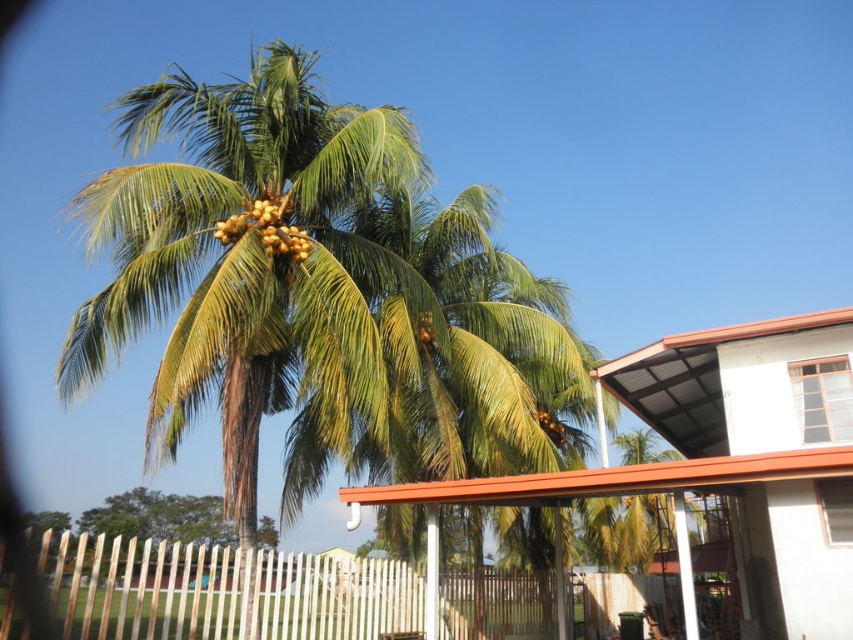
Question: Estimate the real-world distances between objects in this image. Which object is farther from the white wooden fence at lower left?

Choices:
 (A) green leafy palm at lower left
 (B) yellow matte coconuts at center
 (C) green leafy coconut tree at center

Answer: (B)

Question: Which point appears closest to the camera in this image?

Choices:
 (A) (416, 321)
 (B) (352, 497)
 (C) (140, 538)

Answer: (B)

Question: Which object is farther from the camera taking this photo?

Choices:
 (A) green leafy palm at lower left
 (B) green leafy coconut tree at center

Answer: (B)

Question: Observing the image, what is the correct spatial positioning of green leafy coconut tree at center in reference to yellow matte coconuts at upper center?

Choices:
 (A) below
 (B) above

Answer: (A)

Question: Does brown corrugated metal roof at upper center appear on the right side of white wooden fence at lower left?

Choices:
 (A) no
 (B) yes

Answer: (B)

Question: Is green leafy palm at lower left closer to the viewer compared to yellow matte coconuts at center?

Choices:
 (A) yes
 (B) no

Answer: (A)